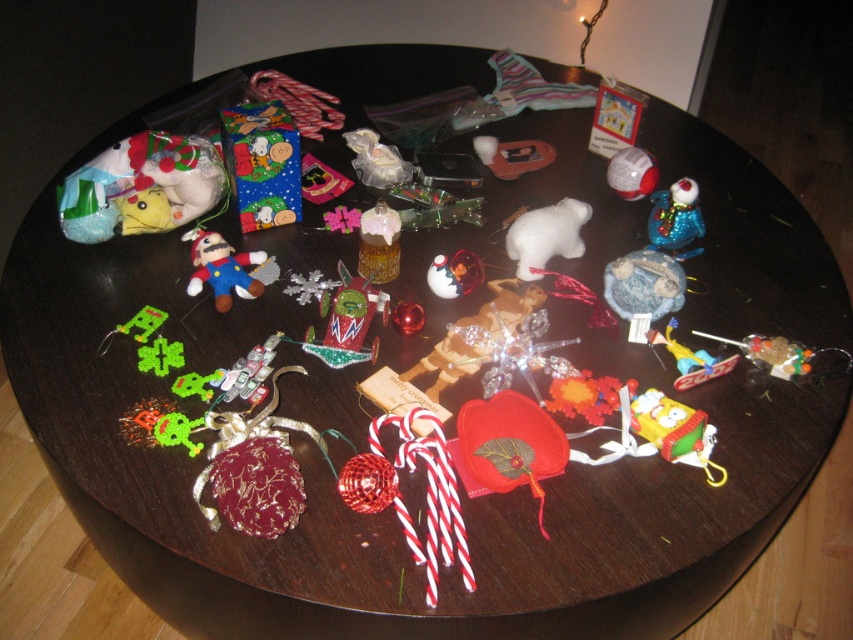
You are organizing the Christmas decorations on the table. You need to place the yellow fabric sponge at lower right and the velvet plush mario at center into a box. Which one should you pick up first to avoid knocking over the other?

You should pick up the velvet plush mario at center first because the yellow fabric sponge at lower right is located below it, so moving the upper item first would prevent disturbing the lower one.

In the scene shown: You are standing 5 feet away from the round wooden table. You want to pick up the shiny metallic car at center. Can you reach it without moving your feet?

The shiny metallic car at center is 3.52 feet away from the viewer. Since you are standing 5 feet away from the table, you cannot reach it without moving your feet because the distance from you to the car is greater than your reach.

You are standing in front of the round wooden table covered with Christmas decorations. There are two points marked on the table surface at coordinates point (363, 332) and point (207, 260). If you want to pick up an ornament from the closer point to you, which coordinate should you reach for?

Point (363, 332) is closer to the camera than point (207, 260), so you should reach for the ornament at point (363, 332).